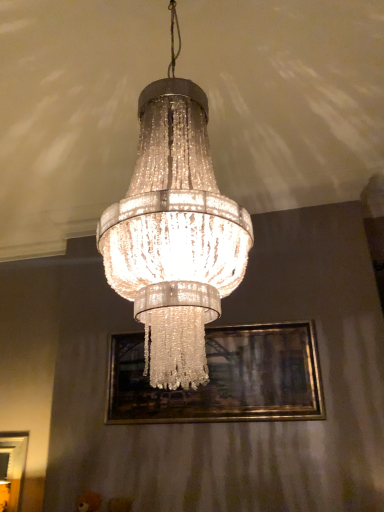
Question: From a real-world perspective, is gold metallic picture frame at center above or below clear crystal chandelier at center?

Choices:
 (A) below
 (B) above

Answer: (A)

Question: Is gold metallic picture frame at center in front of or behind clear crystal chandelier at center in the image?

Choices:
 (A) front
 (B) behind

Answer: (B)

Question: Is point (266, 380) closer or farther from the camera than point (190, 119)?

Choices:
 (A) closer
 (B) farther

Answer: (B)

Question: Is clear crystal chandelier at center wider or thinner than gold metallic picture frame at center?

Choices:
 (A) thin
 (B) wide

Answer: (B)

Question: In terms of size, does clear crystal chandelier at center appear bigger or smaller than gold metallic picture frame at center?

Choices:
 (A) small
 (B) big

Answer: (B)

Question: Is clear crystal chandelier at center in front of or behind gold metallic picture frame at center in the image?

Choices:
 (A) front
 (B) behind

Answer: (A)

Question: From a real-world perspective, is clear crystal chandelier at center positioned above or below gold metallic picture frame at center?

Choices:
 (A) above
 (B) below

Answer: (A)